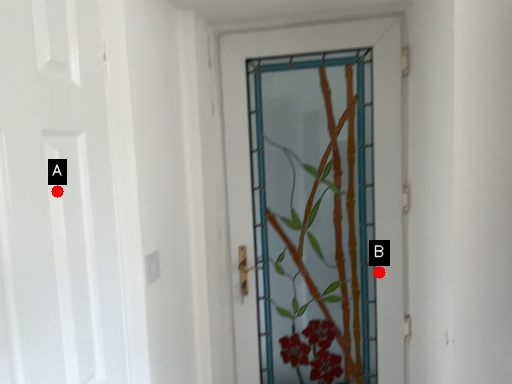
Question: Two points are circled on the image, labeled by A and B beside each circle. Among these points, which one is nearest to the camera?

Choices:
 (A) A is closer
 (B) B is closer

Answer: (A)